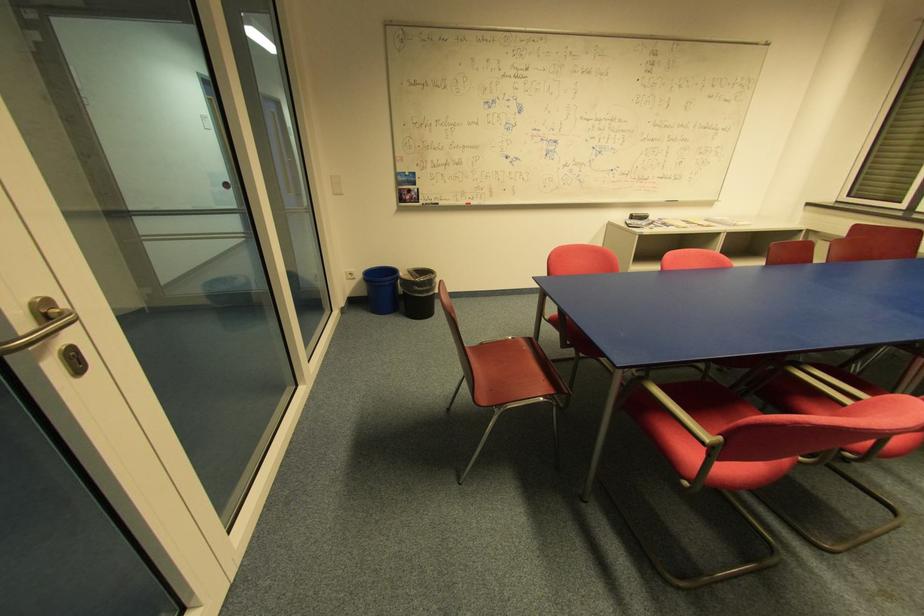
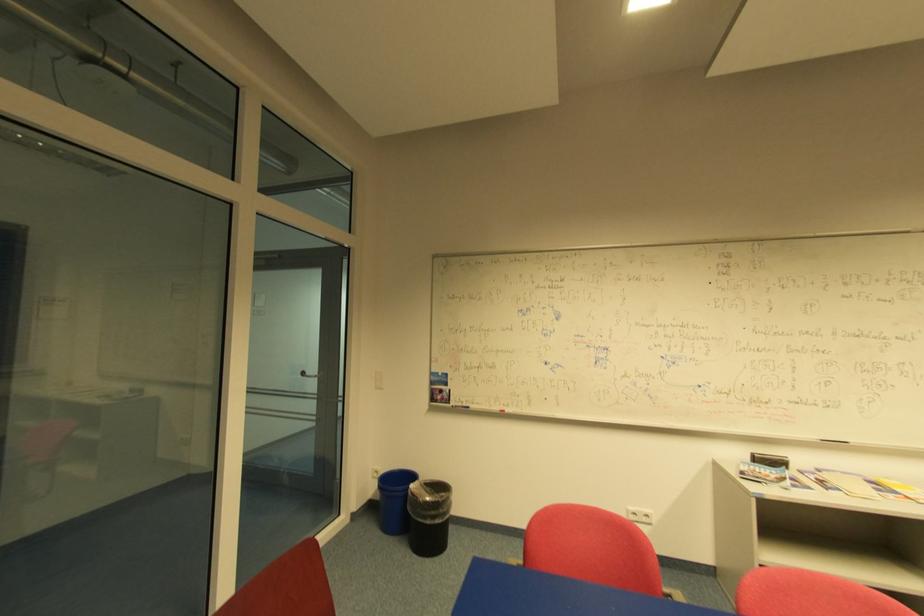
In the second image, find the point that corresponds to (x=405, y=275) in the first image.

(416, 485)